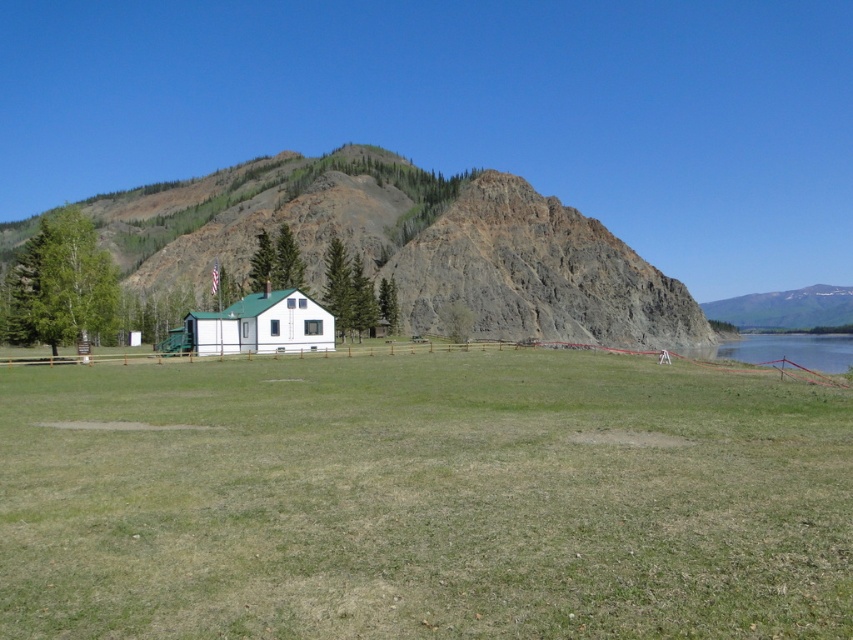
You are standing in the middle of the green grassy field at center and want to reach the rustic stone mountain at center. Which direction should you move to get closer to the mountain?

Since the green grassy field at center is closer to the viewer than the rustic stone mountain at center, you should move forward away from the viewer to reach the rustic stone mountain at center.

You are standing in the middle of the green grassy field at center and want to walk to the white matte cabin at center. Which direction should you head to reach the cabin?

The green grassy field at center is positioned on the right side of the white matte cabin at center, so you should head to the left to reach the cabin.